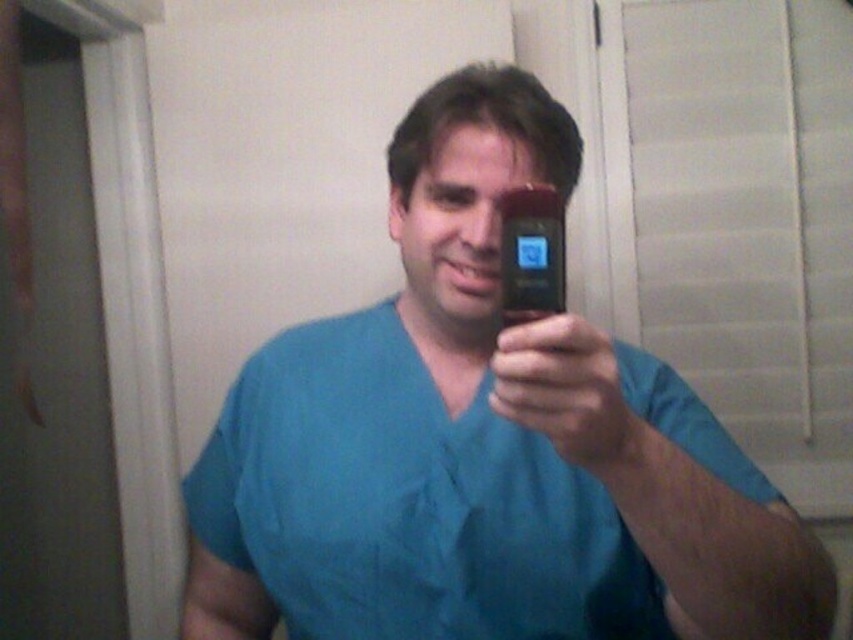
Between blue fabric shirt at center and black matte phone at center, which one has less height?

black matte phone at center

Which of these two, blue fabric shirt at center or black matte phone at center, stands taller?

blue fabric shirt at center is taller.

The image size is (853, 640). What do you see at coordinates (482, 445) in the screenshot?
I see `blue fabric shirt at center` at bounding box center [482, 445].

Where is `blue fabric shirt at center`? Image resolution: width=853 pixels, height=640 pixels. blue fabric shirt at center is located at coordinates (482, 445).

Does point (520, 380) lie behind point (525, 189)?

No, (520, 380) is in front of (525, 189).

This screenshot has width=853, height=640. I want to click on black matte phone at center, so click(x=567, y=392).

Describe the element at coordinates (482, 445) in the screenshot. I see `blue fabric shirt at center` at that location.

Who is positioned more to the left, blue fabric shirt at center or black glossy smartphone at center?

From the viewer's perspective, blue fabric shirt at center appears more on the left side.

The image size is (853, 640). Describe the element at coordinates (482, 445) in the screenshot. I see `blue fabric shirt at center` at that location.

Where is `blue fabric shirt at center`? This screenshot has width=853, height=640. blue fabric shirt at center is located at coordinates (482, 445).